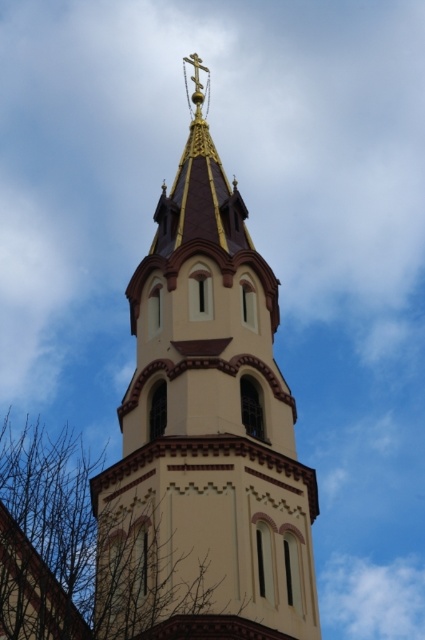
Is point (133, 595) closer to viewer compared to point (22, 470)?

Yes.

Describe the element at coordinates (204, 435) in the screenshot. I see `matte gold spire at center` at that location.

Where is `matte gold spire at center`? matte gold spire at center is located at coordinates (204, 435).